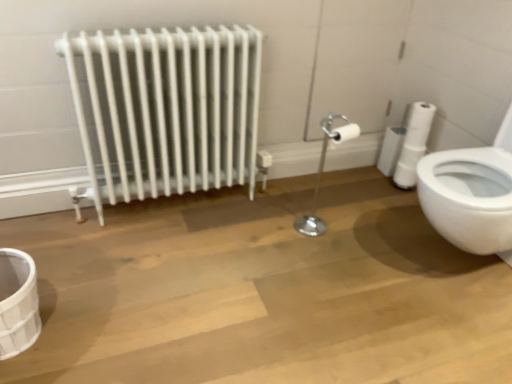
Question: Is white matte toilet paper at right bigger or smaller than white metallic radiator at left?

Choices:
 (A) big
 (B) small

Answer: (B)

Question: From a real-world perspective, is white matte toilet paper at right above or below white metallic radiator at left?

Choices:
 (A) below
 (B) above

Answer: (A)

Question: In terms of height, does white matte toilet paper at right look taller or shorter compared to white metallic radiator at left?

Choices:
 (A) tall
 (B) short

Answer: (B)

Question: Does point (227, 132) appear closer or farther from the camera than point (411, 140)?

Choices:
 (A) farther
 (B) closer

Answer: (B)

Question: Is white metallic radiator at left situated inside white matte toilet paper at right or outside?

Choices:
 (A) outside
 (B) inside

Answer: (A)

Question: Is white metallic radiator at left taller or shorter than white matte toilet paper at right?

Choices:
 (A) short
 (B) tall

Answer: (B)

Question: Would you say white metallic radiator at left is to the left or to the right of white matte toilet paper at right in the picture?

Choices:
 (A) left
 (B) right

Answer: (A)